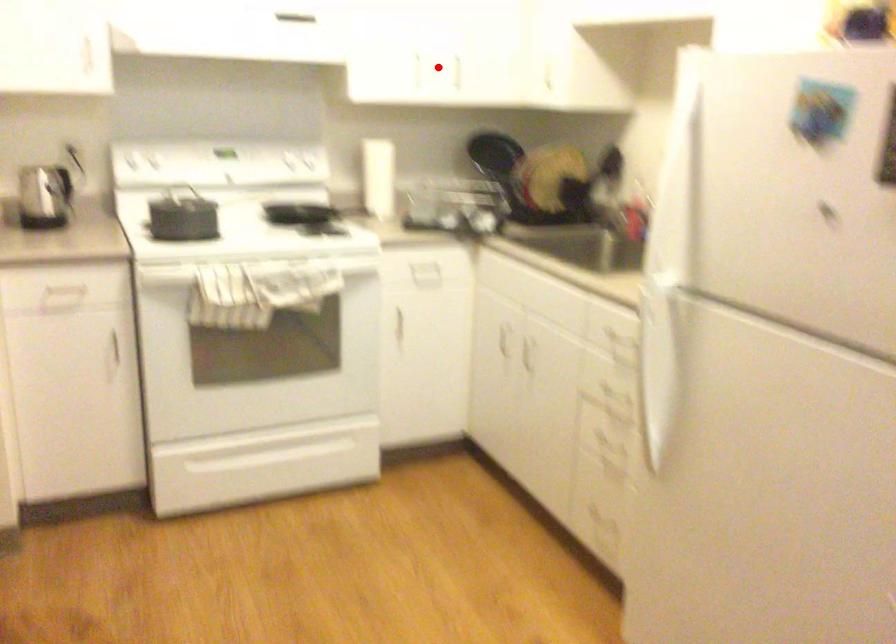
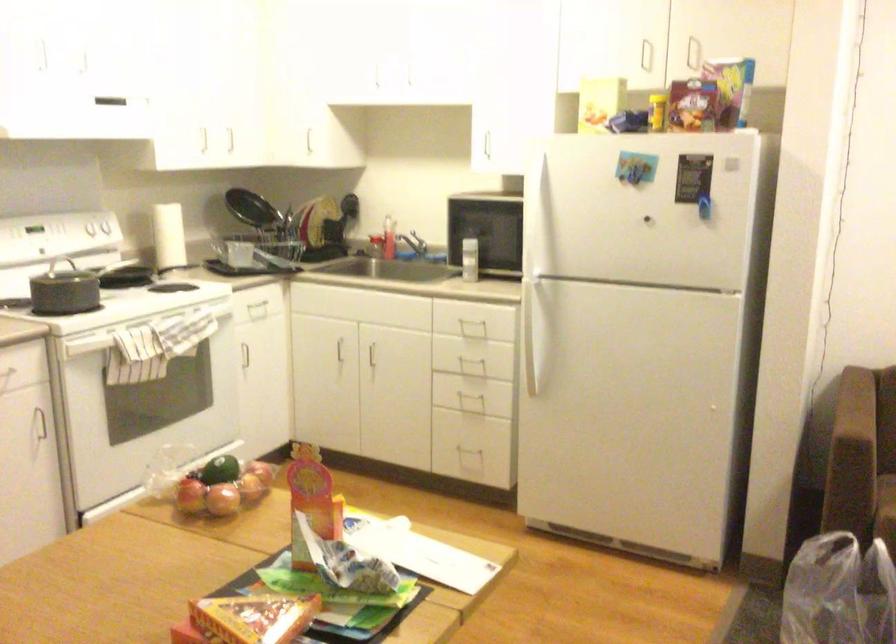
Locate, in the second image, the point that corresponds to the highlighted location in the first image.

(229, 140)